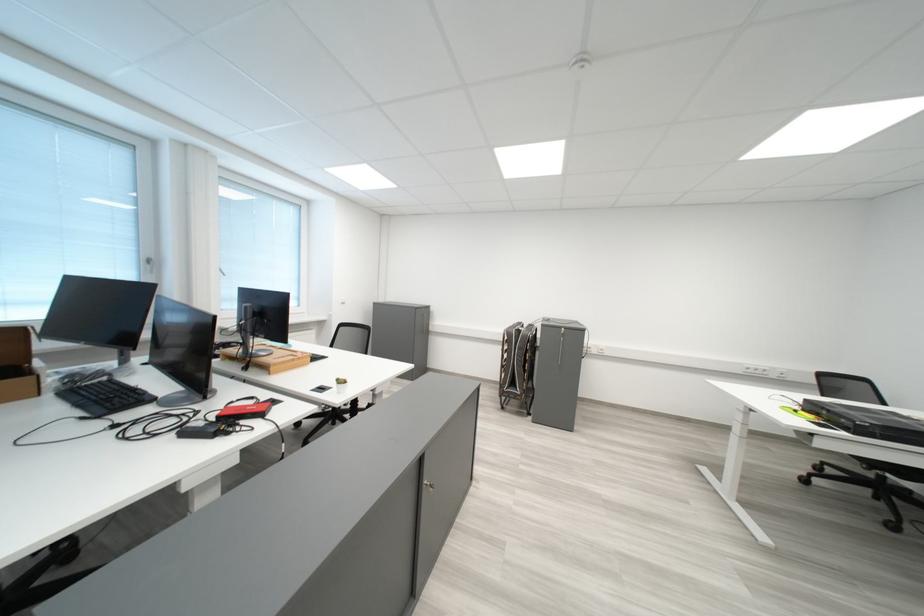
Locate an element on the screen. This screenshot has width=924, height=616. cardboard box is located at coordinates (17, 365).